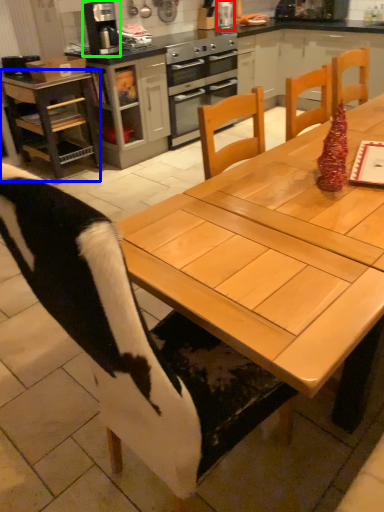
Question: Which object is the closest to the appliance (highlighted by a red box)? Choose among these: desk (highlighted by a blue box) or kitchen appliance (highlighted by a green box).

Choices:
 (A) desk
 (B) kitchen appliance

Answer: (B)